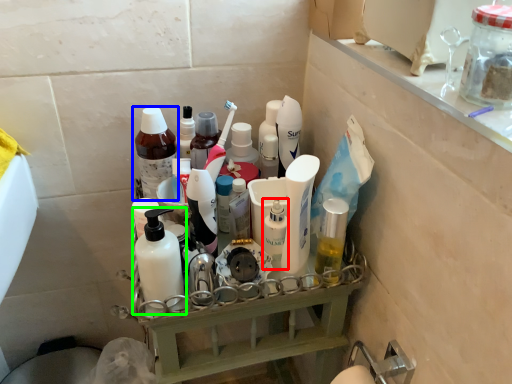
Question: Considering the real-world distances, which object is closest to toiletry (highlighted by a red box)? bottle (highlighted by a blue box) or bottle (highlighted by a green box).

Choices:
 (A) bottle
 (B) bottle

Answer: (B)